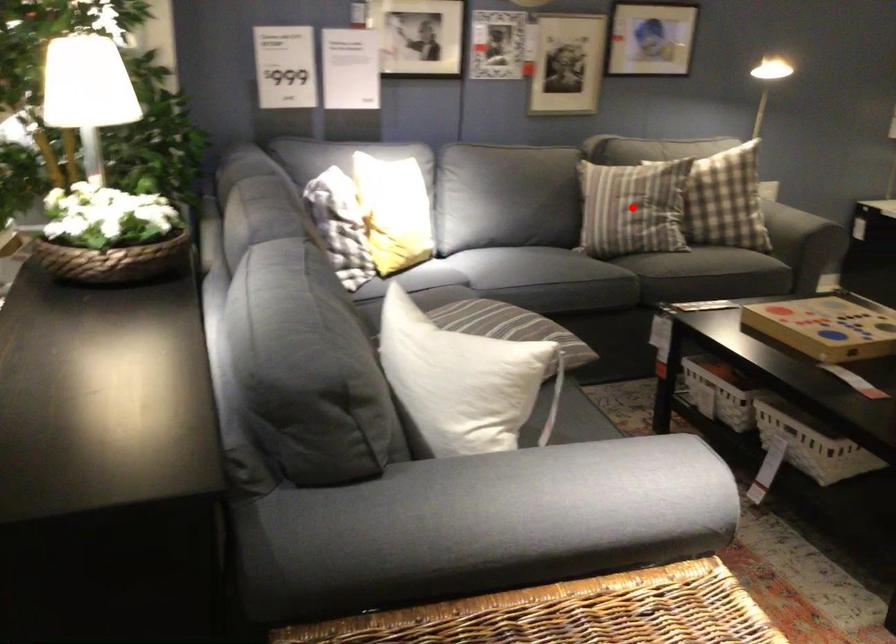
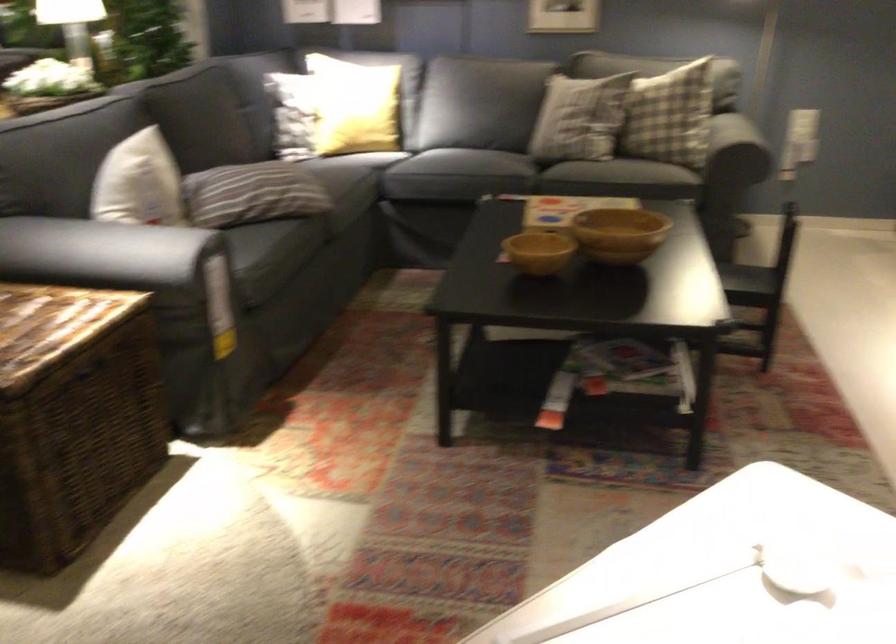
Question: I am providing you with two images of the same scene from different viewpoints. A red point is marked on the first image. Is the red point's position out of view in image 2?

Choices:
 (A) Yes
 (B) No

Answer: (A)